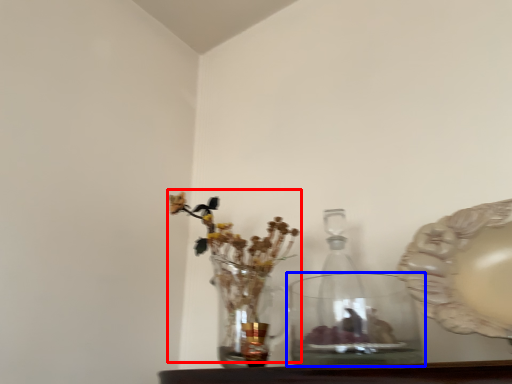
Question: Among these objects, which one is farthest to the camera, floral arrangement (highlighted by a red box) or vase (highlighted by a blue box)?

Choices:
 (A) floral arrangement
 (B) vase

Answer: (A)